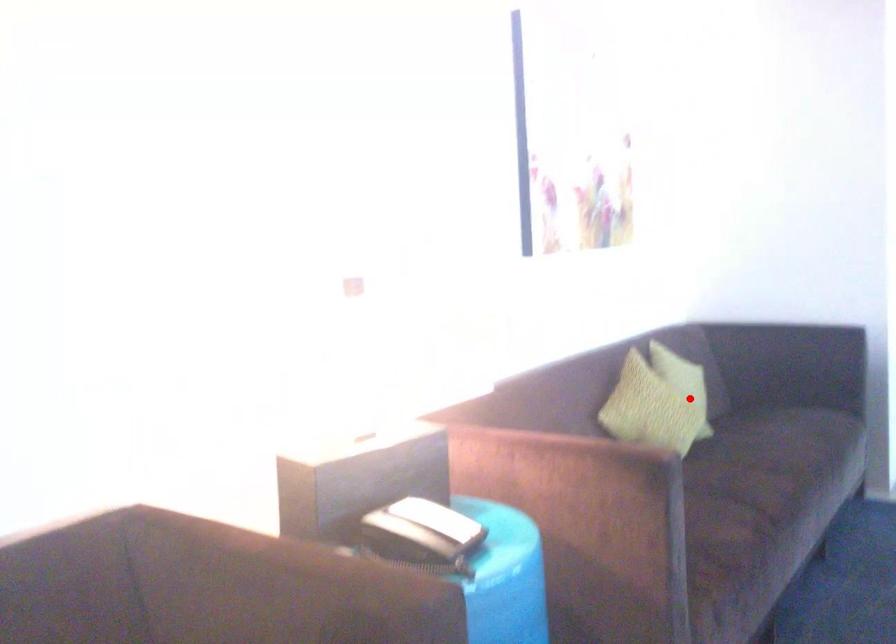
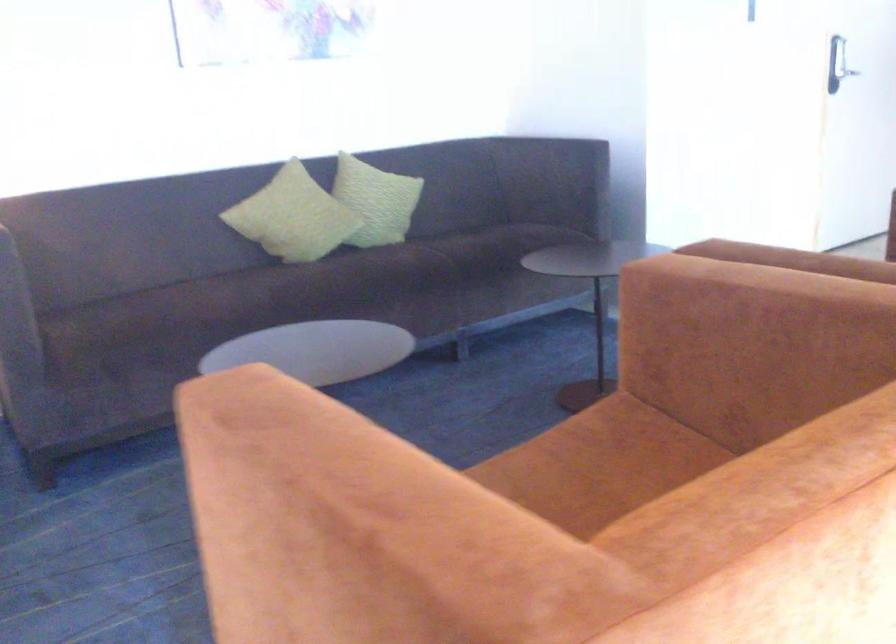
Where in the second image is the point corresponding to the highlighted location from the first image?

(293, 216)